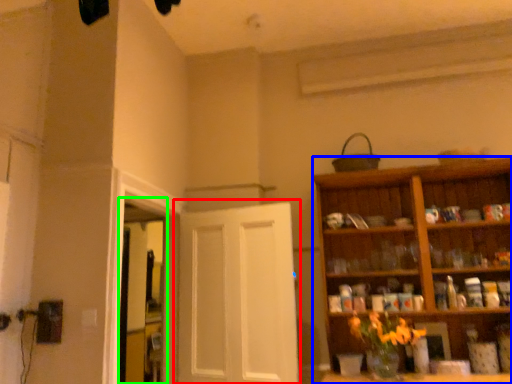
Question: Estimate the real-world distances between objects in this image. Which object is closer to door (highlighted by a red box), cabinetry (highlighted by a blue box) or window (highlighted by a green box)?

Choices:
 (A) cabinetry
 (B) window

Answer: (B)